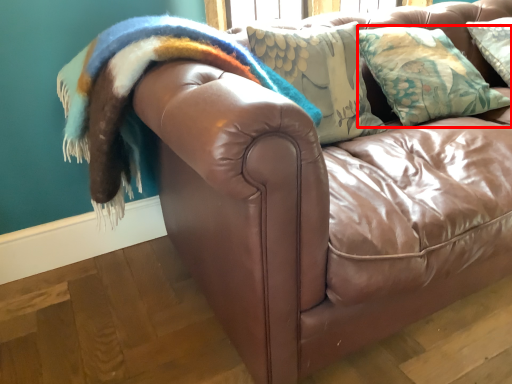
Question: Observing the image, what is the correct spatial positioning of pillow (annotated by the red box) in reference to blanket?

Choices:
 (A) right
 (B) left

Answer: (A)